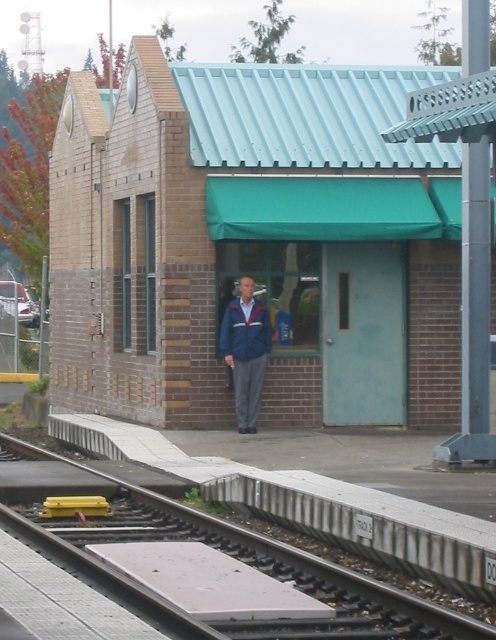
Question: Does metallic gray train track at lower left appear under blue fabric jacket at center?

Choices:
 (A) no
 (B) yes

Answer: (B)

Question: Can you confirm if brown brick building at center is thinner than blue fabric jacket at center?

Choices:
 (A) no
 (B) yes

Answer: (B)

Question: Based on their relative distances, which object is nearer to the metallic gray train track at lower left?

Choices:
 (A) brown brick building at center
 (B) blue fabric jacket at center

Answer: (B)

Question: Which object is positioned farthest from the metallic gray train track at lower left?

Choices:
 (A) blue fabric jacket at center
 (B) brown brick building at center

Answer: (B)

Question: Does brown brick building at center appear on the left side of blue fabric jacket at center?

Choices:
 (A) yes
 (B) no

Answer: (B)

Question: Based on their relative distances, which object is nearer to the metallic gray train track at lower left?

Choices:
 (A) blue fabric jacket at center
 (B) brown brick building at center

Answer: (A)